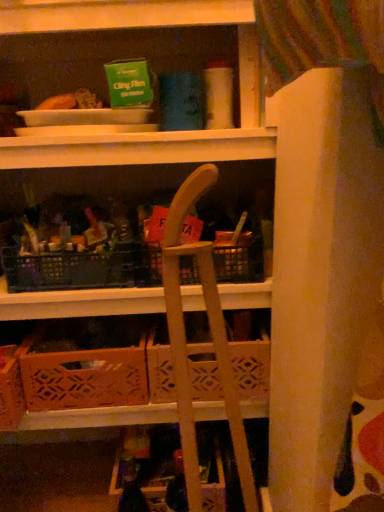
The image size is (384, 512). What do you see at coordinates (84, 378) in the screenshot? I see `wooden crate at lower center` at bounding box center [84, 378].

In order to face wooden crate at lower center, should I rotate leftwards or rightwards?

You should look left and rotate roughly 12.308 degrees.

The width and height of the screenshot is (384, 512). What do you see at coordinates (251, 367) in the screenshot?
I see `wooden crate at center` at bounding box center [251, 367].

Locate an element on the screen. This screenshot has width=384, height=512. wooden folding chair at center is located at coordinates (197, 344).

From the image's perspective, which is below, wooden crate at center or wooden folding chair at center?

wooden folding chair at center appears lower in the image.

Is wooden crate at center smaller than wooden folding chair at center?

Yes, wooden crate at center is smaller than wooden folding chair at center.

Is point (155, 342) farther from viewer compared to point (234, 396)?

Yes.

Considering the sizes of wooden crate at center and wooden folding chair at center in the image, is wooden crate at center taller or shorter than wooden folding chair at center?

Considering their sizes, wooden crate at center has less height than wooden folding chair at center.

Does wooden crate at lower center turn towards wooden folding chair at center?

No.

Is wooden crate at lower center positioned beyond the bounds of wooden folding chair at center?

Yes, wooden crate at lower center is outside of wooden folding chair at center.

What's the angular difference between wooden crate at lower center and wooden folding chair at center's facing directions?

The angle between the facing direction of wooden crate at lower center and the facing direction of wooden folding chair at center is 82.2 degrees.

Which is more to the right, wooden crate at lower center or wooden folding chair at center?

wooden folding chair at center.

Who is more distant, wooden crate at center or wooden crate at lower center?

Positioned behind is wooden crate at center.

From the image's perspective, is wooden crate at center positioned above or below wooden crate at lower center?

Based on their image positions, wooden crate at center is located above wooden crate at lower center.

Is wooden crate at center far from wooden crate at lower center?

No, wooden crate at center is not far away from wooden crate at lower center.

Does wooden crate at center have a lesser width compared to wooden crate at lower center?

Yes, wooden crate at center is thinner than wooden crate at lower center.

Is wooden crate at lower center positioned with its back to wooden crate at center?

No.

How far apart are wooden crate at lower center and wooden crate at center?

wooden crate at lower center and wooden crate at center are 6.25 inches apart.

From a real-world perspective, is wooden crate at lower center positioned above or below wooden crate at center?

From a real-world perspective, wooden crate at lower center is physically below wooden crate at center.

Is point (74, 352) less distant than point (195, 362)?

Yes, point (74, 352) is in front of point (195, 362).

Could you tell me if wooden folding chair at center is turned towards wooden crate at lower center?

No, wooden folding chair at center is not aimed at wooden crate at lower center.

Does point (211, 184) appear closer or farther from the camera than point (22, 366)?

Point (211, 184) is closer to the camera than point (22, 366).

Where is `crate that is on the left side of wooden folding chair at center`? crate that is on the left side of wooden folding chair at center is located at coordinates (84, 378).

Is the depth of wooden folding chair at center greater than that of wooden crate at center?

No, it is in front of wooden crate at center.

Are wooden folding chair at center and wooden crate at center making contact?

No, wooden folding chair at center is not making contact with wooden crate at center.

Based on the photo, would you say wooden folding chair at center is inside or outside wooden crate at center?

wooden folding chair at center is outside wooden crate at center.

You are a GUI agent. You are given a task and a screenshot of the screen. Output one action in this format:
    pyautogui.click(x=<x>, y=<y>)
    Task: Click on the basket lying on the right of wooden folding chair at center
    The image size is (384, 512).
    Given the screenshot: What is the action you would take?
    pyautogui.click(x=251, y=367)

Where is `folding chair in front of the wooden crate at lower center`? folding chair in front of the wooden crate at lower center is located at coordinates (197, 344).

Looking at the image, which one is located further to wooden folding chair at center, wooden crate at center or wooden crate at lower center?

wooden crate at lower center.

Estimate the real-world distances between objects in this image. Which object is further from wooden folding chair at center, wooden crate at lower center or wooden crate at center?

wooden crate at lower center lies further to wooden folding chair at center than the other object.

From the image, which object appears to be farther from wooden crate at lower center, wooden crate at center or wooden folding chair at center?

wooden folding chair at center is further to wooden crate at lower center.

Estimate the real-world distances between objects in this image. Which object is closer to wooden crate at center, wooden crate at lower center or wooden folding chair at center?

wooden folding chair at center lies closer to wooden crate at center than the other object.

From the picture: Based on their spatial positions, is wooden folding chair at center or wooden crate at center closer to wooden crate at lower center?

The object closer to wooden crate at lower center is wooden crate at center.

Considering their positions, is wooden folding chair at center positioned further to wooden crate at center than wooden crate at lower center?

wooden crate at lower center.

Identify the location of crate located between wooden folding chair at center and wooden crate at center in the depth direction. The height and width of the screenshot is (512, 384). (84, 378).